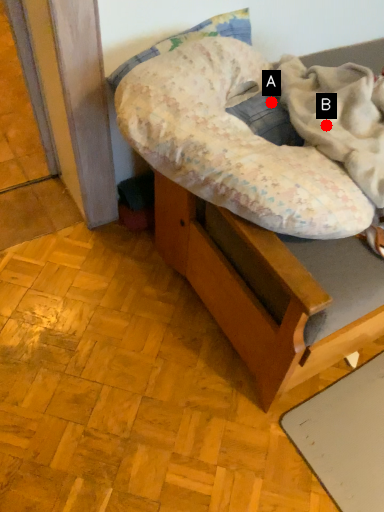
Question: Two points are circled on the image, labeled by A and B beside each circle. Among these points, which one is farthest from the camera?

Choices:
 (A) A is further
 (B) B is further

Answer: (A)